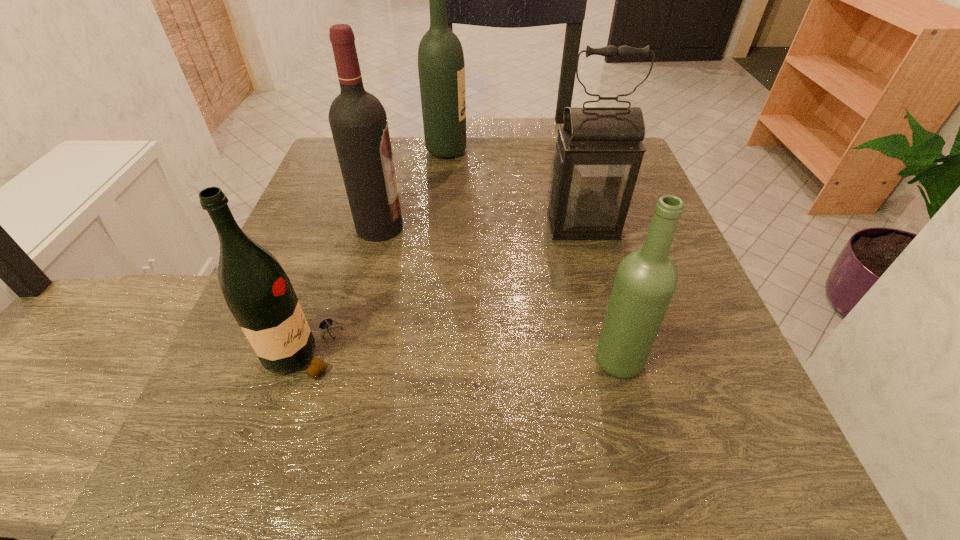
Identify the location of lantern that is at the right edge. (599, 150).

Find the location of a particular element. The width and height of the screenshot is (960, 540). wine bottle at the right edge is located at coordinates (646, 279).

The width and height of the screenshot is (960, 540). I want to click on free space at the far edge of the desktop, so click(x=433, y=172).

Find the location of a particular element. free space at the left edge of the desktop is located at coordinates (338, 258).

Image resolution: width=960 pixels, height=540 pixels. What are the coordinates of `vacant area at the right edge of the desktop` in the screenshot? It's located at (651, 357).

The image size is (960, 540). Identify the location of vacant space at the near right corner of the desktop. (732, 461).

Identify the location of vacant space that is in between the third nearest wine bottle and the lantern. Image resolution: width=960 pixels, height=540 pixels. (481, 226).

The width and height of the screenshot is (960, 540). Find the location of `free spot between the farthest wine bottle and the third nearest wine bottle`. free spot between the farthest wine bottle and the third nearest wine bottle is located at coordinates (413, 189).

Find the location of a particular element. Image resolution: width=960 pixels, height=540 pixels. vacant space that is in between the rightmost wine bottle and the second farthest wine bottle is located at coordinates (498, 293).

The height and width of the screenshot is (540, 960). Find the location of `vacant area between the lantern and the third nearest wine bottle`. vacant area between the lantern and the third nearest wine bottle is located at coordinates (481, 226).